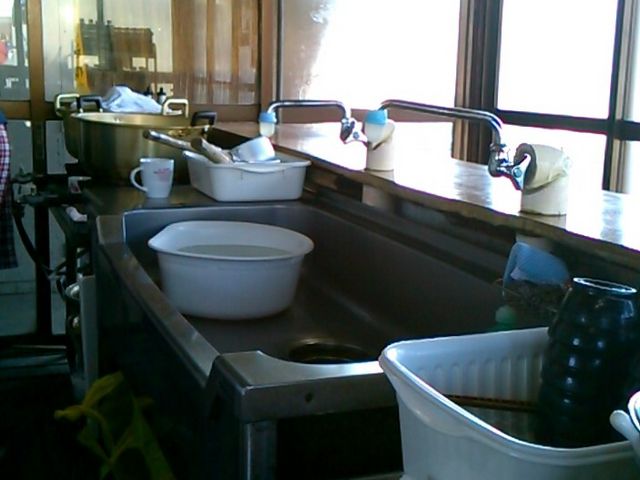
What are the coordinates of `white plastic basket, rectangle shaped` in the screenshot? It's located at (262, 185).